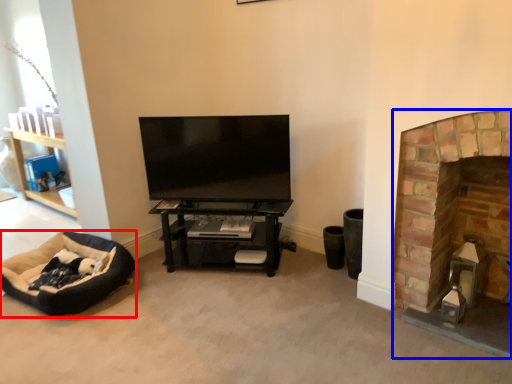
Question: Which of the following is the farthest to the observer, dog bed (highlighted by a red box) or fireplace (highlighted by a blue box)?

Choices:
 (A) dog bed
 (B) fireplace

Answer: (A)